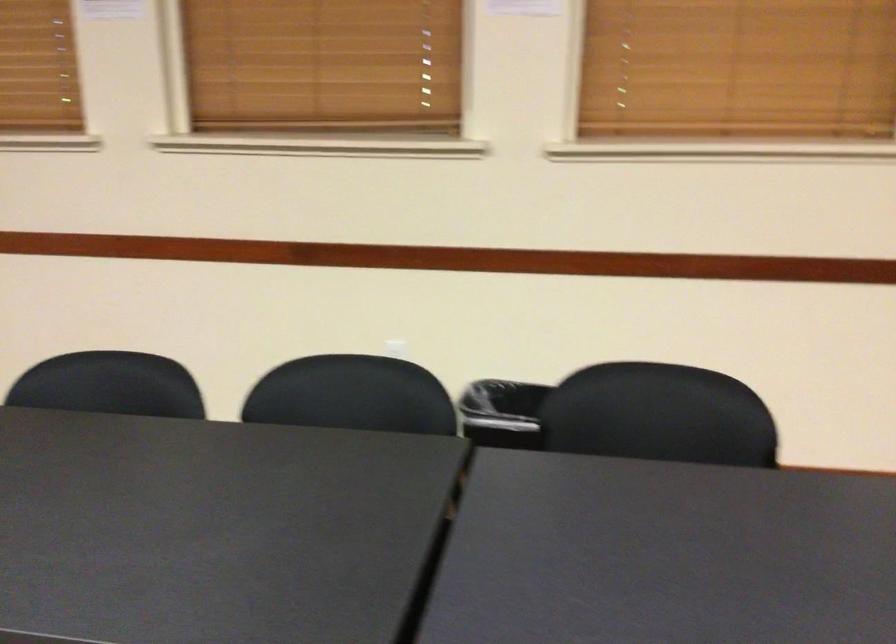
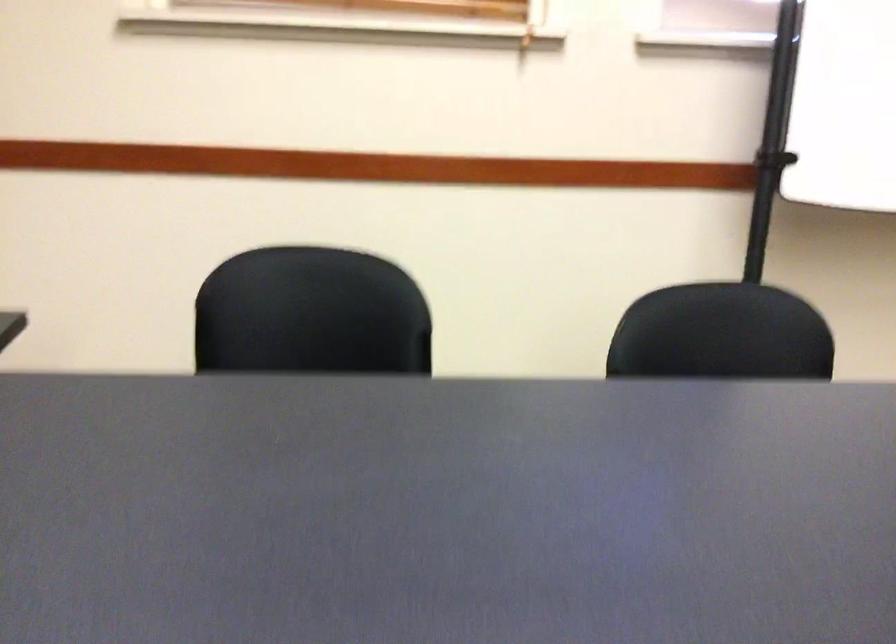
How did the camera likely rotate?

The camera's rotation is toward right-down.